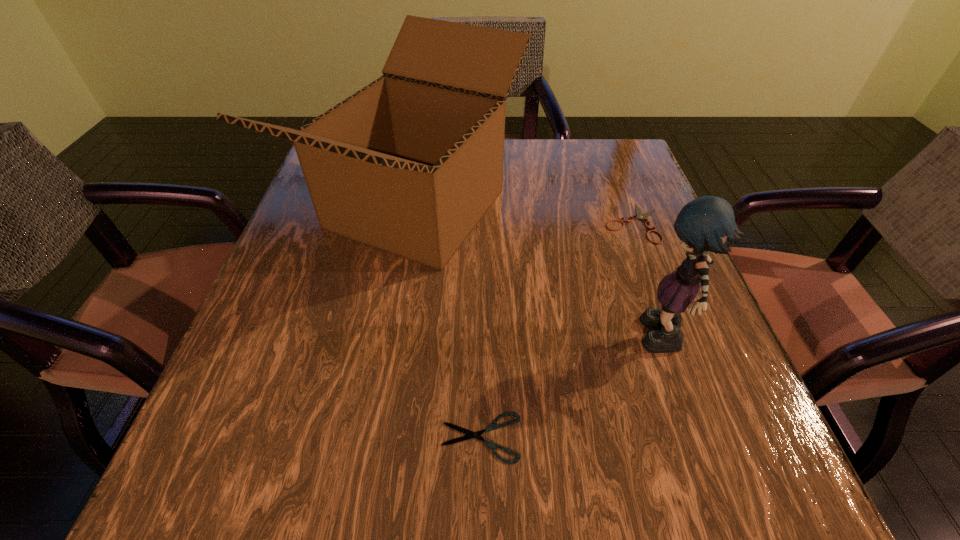
Locate an element on the screen. The width and height of the screenshot is (960, 540). free space between the shortest object and the box is located at coordinates (448, 323).

Locate an element on the screen. The height and width of the screenshot is (540, 960). free space between the box and the taller shears is located at coordinates (525, 216).

This screenshot has height=540, width=960. What are the coordinates of `free point between the rag doll and the box` in the screenshot? It's located at (540, 275).

Select which object appears as the second closest to the third tallest object. Please provide its 2D coordinates. Your answer should be formatted as a tuple, i.e. [(x, y)], where the tuple contains the x and y coordinates of a point satisfying the conditions above.

[(707, 223)]

You are a GUI agent. You are given a task and a screenshot of the screen. Output one action in this format:
    pyautogui.click(x=<x>, y=<y>)
    Task: Click on the object identified as the third closest to the rag doll
    The width and height of the screenshot is (960, 540).
    Given the screenshot: What is the action you would take?
    pyautogui.click(x=470, y=434)

You are a GUI agent. You are given a task and a screenshot of the screen. Output one action in this format:
    pyautogui.click(x=<x>, y=<y>)
    Task: Click on the vacant space that satisfies the following two spatial constraints: 1. on the back side of the farther shears; 2. on the right side of the shortest object
    This screenshot has width=960, height=540.
    Given the screenshot: What is the action you would take?
    tap(481, 223)